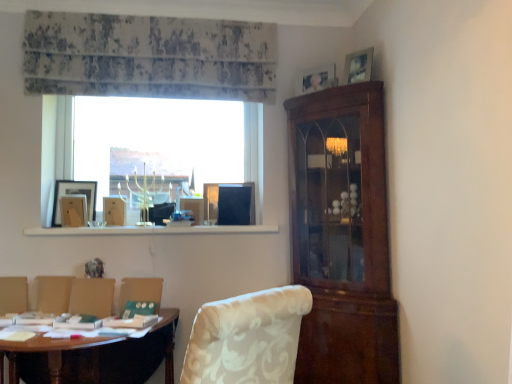
The width and height of the screenshot is (512, 384). I want to click on blank space situated above white textured fabric at upper center (from a real-world perspective), so pyautogui.click(x=158, y=16).